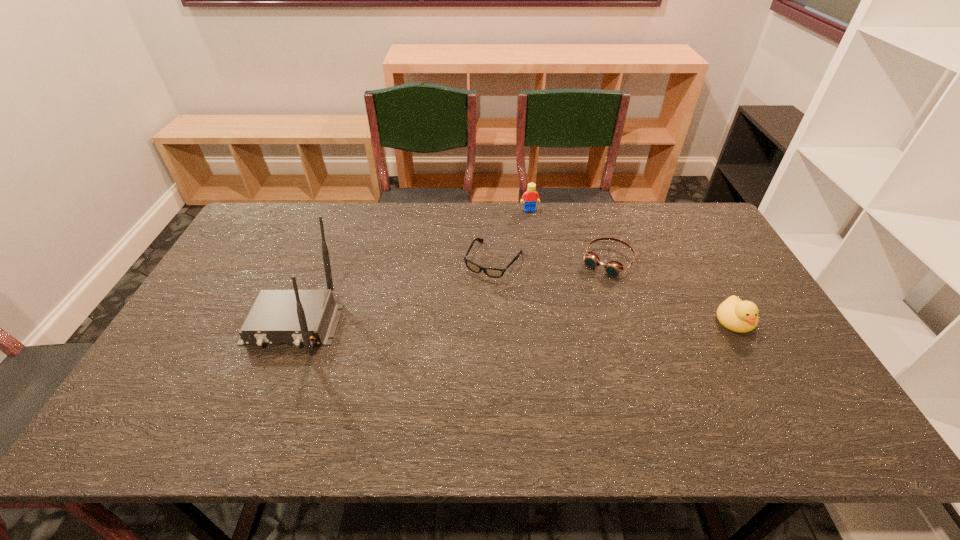
I want to click on object that ranks as the closest to the router, so click(x=490, y=272).